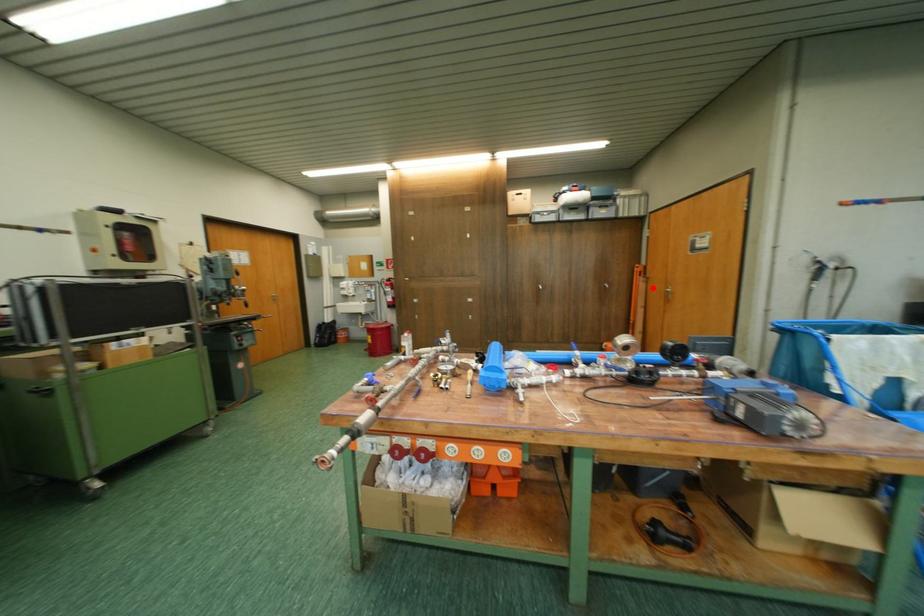
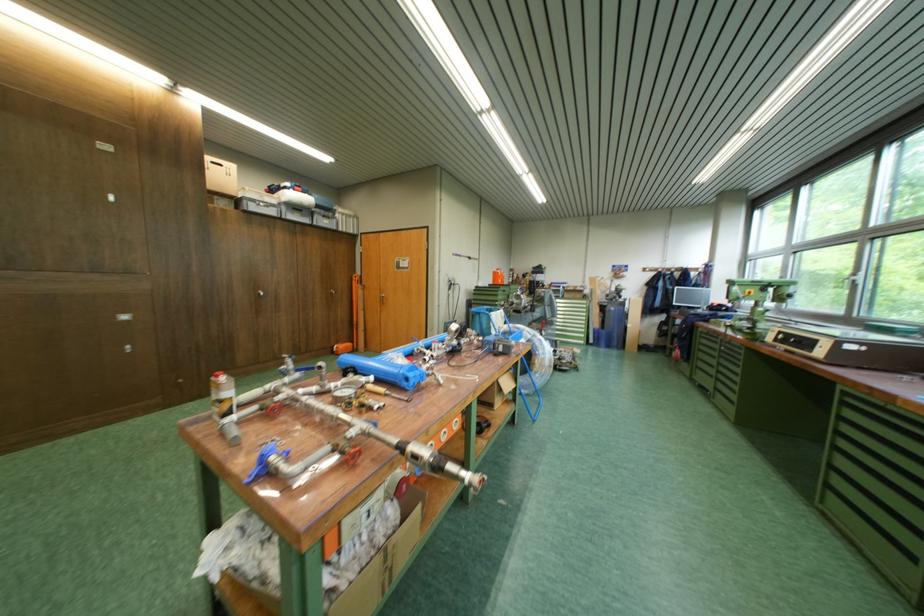
Find the pixel in the second image that matches the highlighted location in the first image.

(371, 294)